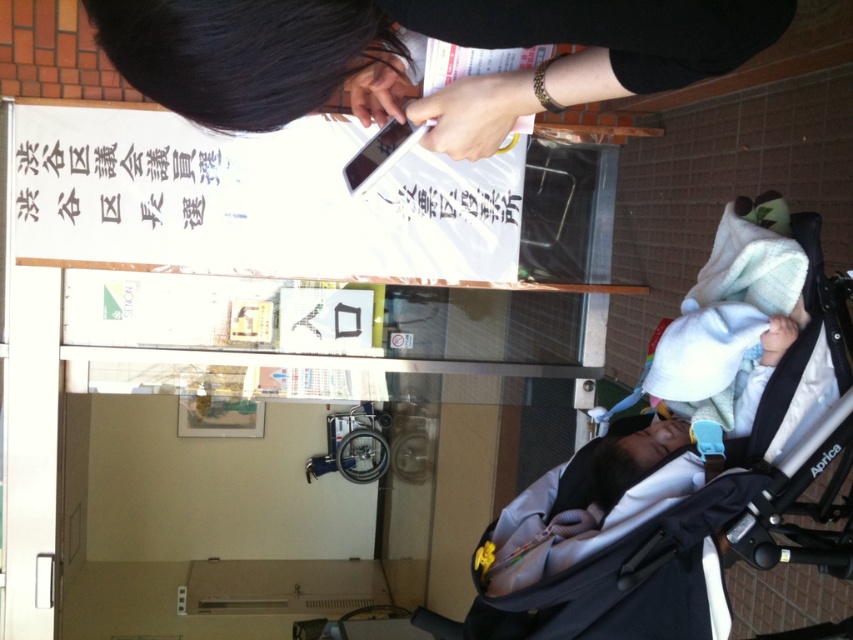
Question: Is black fabric baby carriage at lower right positioned behind black matte phone at upper center?

Choices:
 (A) no
 (B) yes

Answer: (B)

Question: Can you confirm if black fabric baby carriage at lower right is positioned to the left of black matte phone at upper center?

Choices:
 (A) yes
 (B) no

Answer: (B)

Question: Does black fabric baby carriage at lower right lie behind black matte phone at upper center?

Choices:
 (A) no
 (B) yes

Answer: (B)

Question: Among these objects, which one is nearest to the camera?

Choices:
 (A) black matte phone at upper center
 (B) black fabric baby carriage at lower right

Answer: (A)